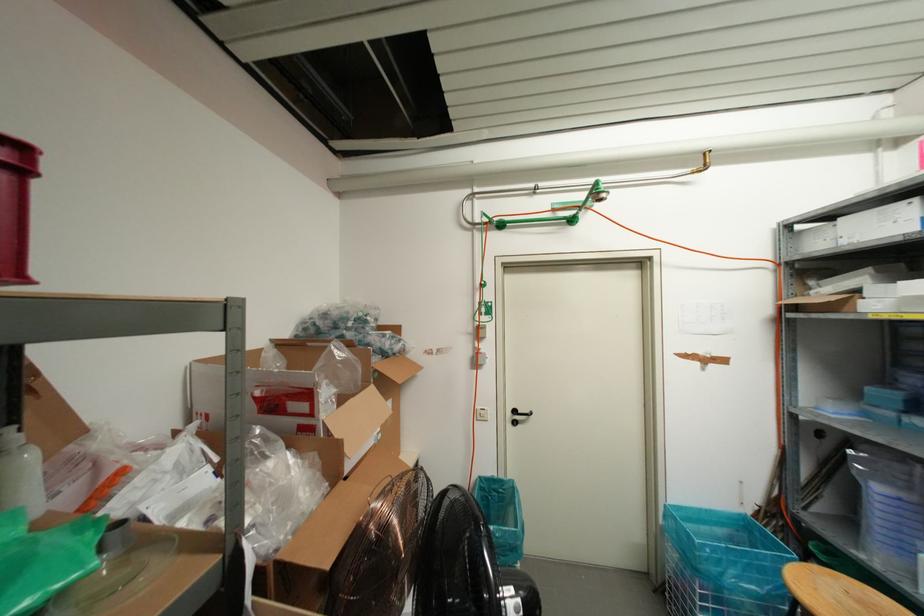
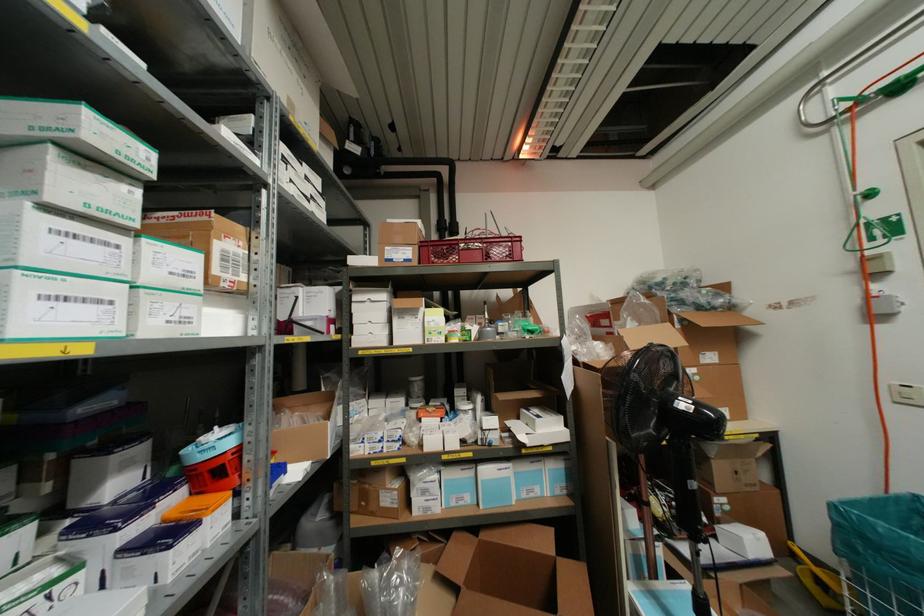
The point at (489, 222) is marked in the first image. Where is the corresponding point in the second image?

(859, 100)